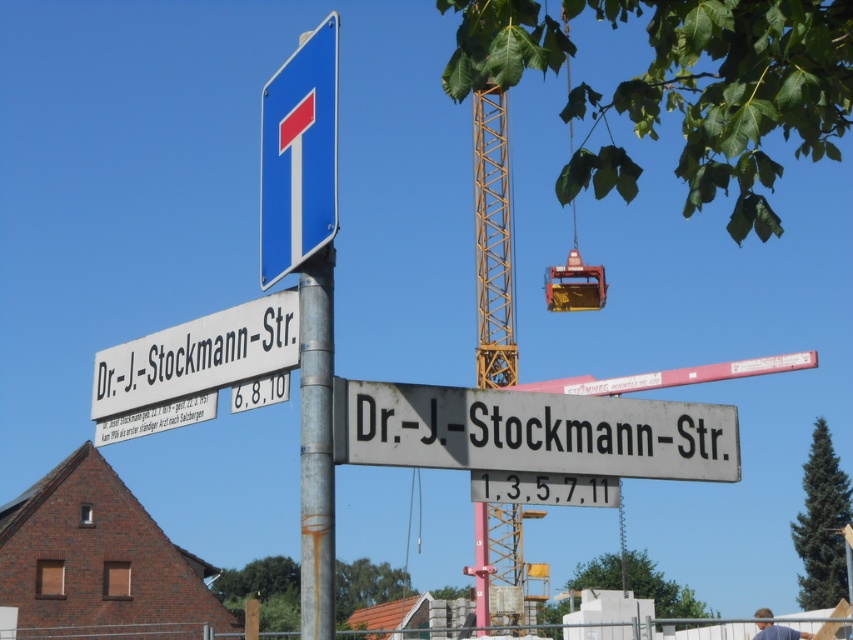
You are a pedestrian walking on the street and see the blue plastic sign at upper center and the rusty metal pole at center. Which object is closer to you?

The blue plastic sign at upper center is closer to you because the rusty metal pole at center is behind it.